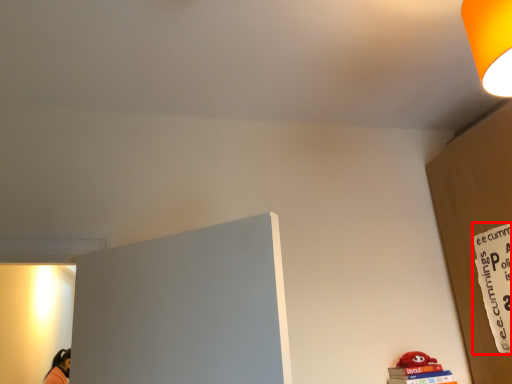
Question: From the image's perspective, what is the correct spatial relationship of warning sign (annotated by the red box) in relation to lamp?

Choices:
 (A) above
 (B) below

Answer: (B)